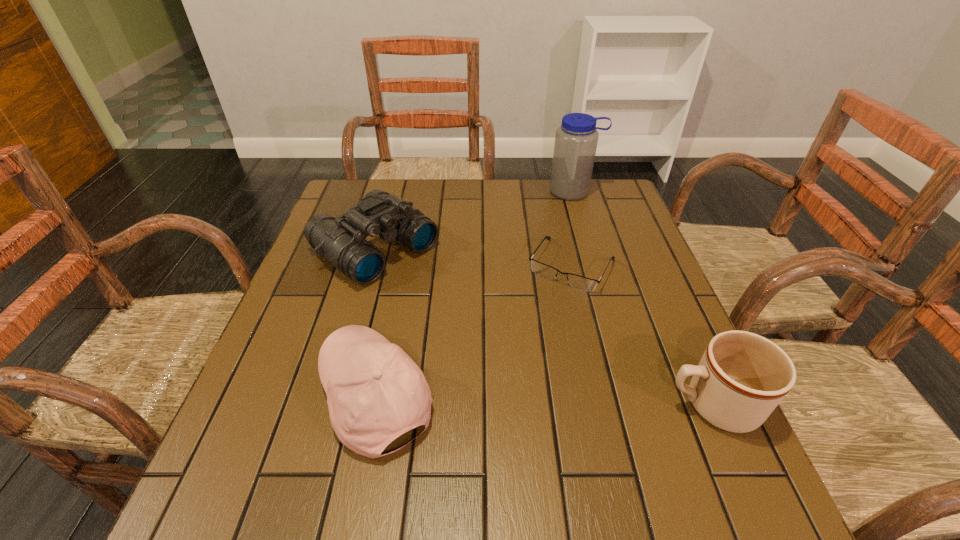
Identify the location of empty space between the binoculars and the shortest object. (473, 257).

The width and height of the screenshot is (960, 540). I want to click on vacant point located between the baseball cap and the mug, so click(543, 400).

I want to click on free area in between the spectacles and the baseball cap, so click(x=473, y=330).

You are a GUI agent. You are given a task and a screenshot of the screen. Output one action in this format:
    pyautogui.click(x=<x>, y=<y>)
    Task: Click on the free point between the binoculars and the mug
    The width and height of the screenshot is (960, 540).
    Given the screenshot: What is the action you would take?
    pyautogui.click(x=543, y=327)

This screenshot has height=540, width=960. I want to click on free area in between the mug and the baseball cap, so click(543, 400).

The height and width of the screenshot is (540, 960). In order to click on vacant region between the spectacles and the baseball cap in this screenshot , I will do `click(473, 330)`.

Find the location of a particular element. unoccupied position between the mug and the binoculars is located at coordinates (543, 327).

The height and width of the screenshot is (540, 960). Identify the location of empty space between the binoculars and the mug. (543, 327).

Image resolution: width=960 pixels, height=540 pixels. I want to click on object that ranks as the fourth closest to the shortest object, so click(375, 392).

Point out which object is positioned as the fourth nearest to the mug. Please provide its 2D coordinates. Your answer should be formatted as a tuple, i.e. [(x, y)], where the tuple contains the x and y coordinates of a point satisfying the conditions above.

[(576, 139)]